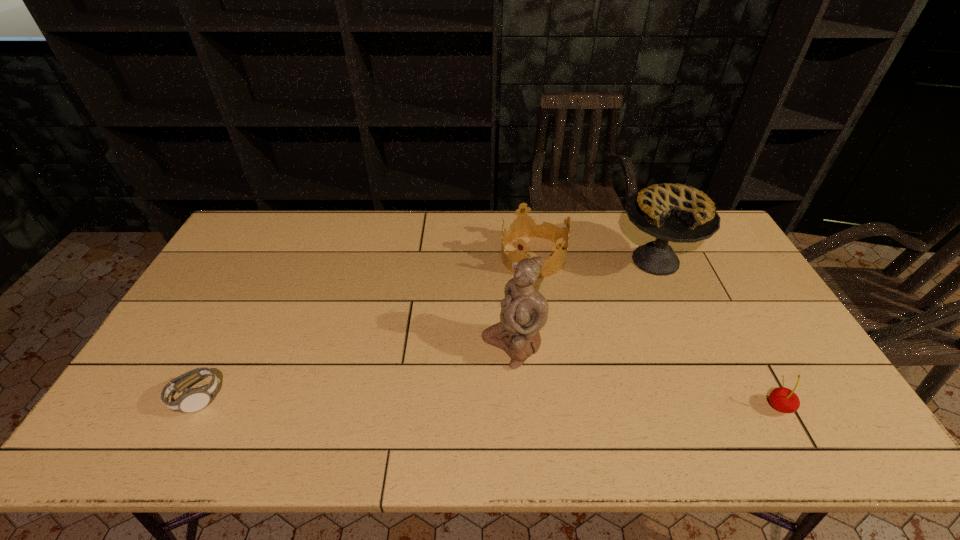
This screenshot has width=960, height=540. What are the coordinates of `the shortest object` in the screenshot? It's located at (x=192, y=400).

Locate an element on the screen. The width and height of the screenshot is (960, 540). watch is located at coordinates (192, 400).

This screenshot has height=540, width=960. I want to click on the fourth tallest object, so click(783, 399).

This screenshot has height=540, width=960. Identify the location of the third nearest object. (523, 310).

Find the location of a particular element. tiara is located at coordinates (523, 226).

Find the location of a particular element. pie is located at coordinates (678, 213).

Identify the location of free region located on the face of the shortest object. (299, 397).

Where is `vacant space situated on the right of the cherry`? vacant space situated on the right of the cherry is located at coordinates (833, 407).

The height and width of the screenshot is (540, 960). What are the coordinates of `free space located 0.240m on the front-facing side of the third farthest object` in the screenshot? It's located at (409, 409).

Identify the location of vacant area situated on the front-facing side of the third farthest object. This screenshot has height=540, width=960. (420, 403).